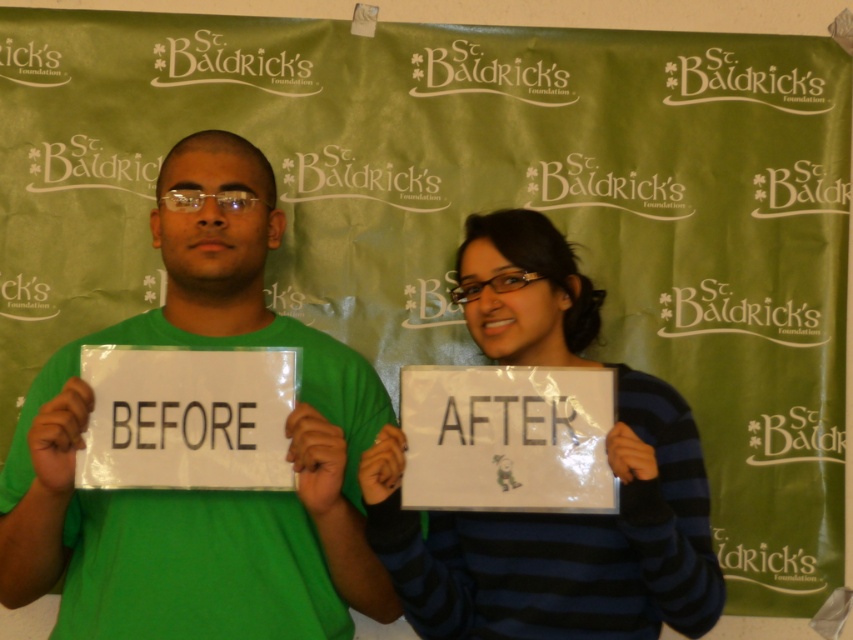
You are organizing a charity event and need to arrange two volunteers holding signs. The volunteers are wearing a green matte shirt at center and a striped sweater at center. According to the image, which volunteer should stand on the left side to match the original setup?

The green matte shirt at center should stand on the left side because it is to the left of the striped sweater at center in the original image.

You are organizing a charity event and need to place two signs on a wall. The signs are labeled with the objects mentioned. If you want to ensure there is enough space between them to read both comfortably, what is the minimum distance you should keep between the green matte shirt at center and the striped sweater at center?

The minimum distance you should keep between the green matte shirt at center and the striped sweater at center is 12.59 inches to ensure comfortable readability.

You are a photographer setting up for a group photo. You notice two people in the frame wearing a green matte shirt at center and a striped sweater at center. Which clothing item is positioned higher on their bodies?

The green matte shirt at center is positioned higher on their bodies than the striped sweater at center because the green matte shirt at center is above the striped sweater at center.